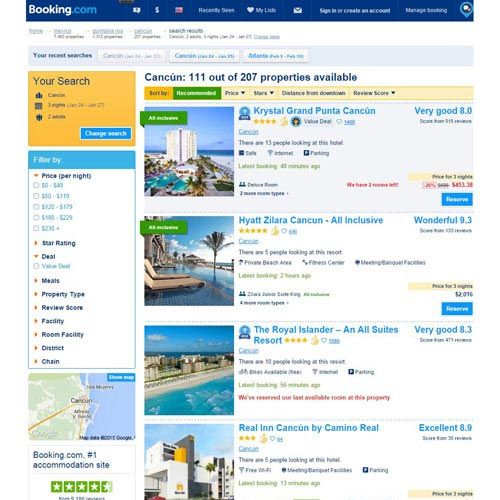
I want to click on lounge chairs, so click(158, 286), click(155, 272).